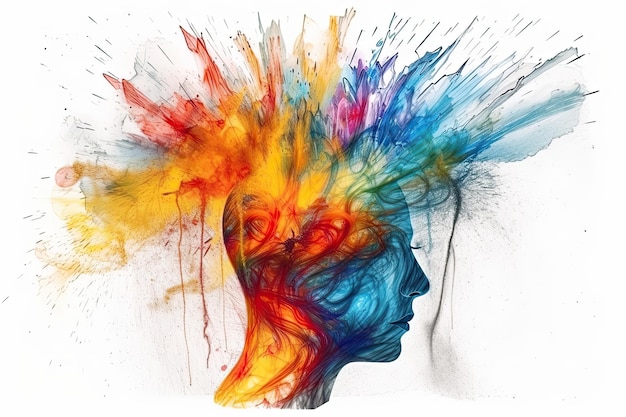
What are the coordinates of `pink/violet paint` in the screenshot? It's located at (x=334, y=117), (x=342, y=103), (x=365, y=108).